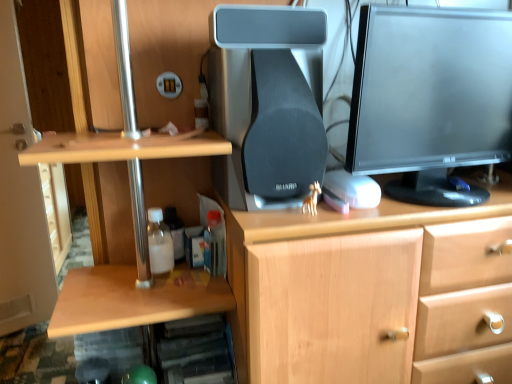
Question: Does matte black monitor at upper right have a lesser width compared to translucent plastic bottle at lower center, acting as the second bottle starting from the left?

Choices:
 (A) no
 (B) yes

Answer: (A)

Question: Could you tell me if matte black monitor at upper right is facing translucent plastic bottle at lower center, acting as the second bottle starting from the left?

Choices:
 (A) no
 (B) yes

Answer: (A)

Question: From the image's perspective, would you say matte black monitor at upper right is shown under translucent plastic bottle at lower center, acting as the second bottle starting from the left?

Choices:
 (A) yes
 (B) no

Answer: (B)

Question: Considering the relative sizes of matte black monitor at upper right and translucent plastic bottle at lower center, the first bottle viewed from the right, in the image provided, is matte black monitor at upper right taller than translucent plastic bottle at lower center, the first bottle viewed from the right,?

Choices:
 (A) no
 (B) yes

Answer: (B)

Question: Could translucent plastic bottle at lower center, the first bottle viewed from the right, be considered to be inside matte black monitor at upper right?

Choices:
 (A) yes
 (B) no

Answer: (B)

Question: From the image's perspective, is matte black monitor at upper right on top of translucent plastic bottle at lower center, the first bottle viewed from the right?

Choices:
 (A) no
 (B) yes

Answer: (B)

Question: Does translucent plastic bottle at lower center, the first bottle viewed from the right, have a larger size compared to black matte speaker at center?

Choices:
 (A) yes
 (B) no

Answer: (B)

Question: Does translucent plastic bottle at lower center, the first bottle viewed from the right, turn towards black matte speaker at center?

Choices:
 (A) no
 (B) yes

Answer: (A)

Question: Is black matte speaker at center surrounded by translucent plastic bottle at lower center, the first bottle viewed from the right?

Choices:
 (A) no
 (B) yes

Answer: (A)

Question: From the image's perspective, is translucent plastic bottle at lower center, the first bottle viewed from the right, over black matte speaker at center?

Choices:
 (A) yes
 (B) no

Answer: (B)

Question: Considering the relative sizes of translucent plastic bottle at lower center, acting as the second bottle starting from the left, and black matte speaker at center in the image provided, is translucent plastic bottle at lower center, acting as the second bottle starting from the left, taller than black matte speaker at center?

Choices:
 (A) yes
 (B) no

Answer: (B)

Question: Does translucent plastic bottle at lower center, acting as the second bottle starting from the left, lie behind black matte speaker at center?

Choices:
 (A) yes
 (B) no

Answer: (A)

Question: Is the depth of translucent plastic bottle at lower left, arranged as the 1th bottle when viewed from the left, greater than that of translucent plastic bottle at lower center, acting as the second bottle starting from the left?

Choices:
 (A) no
 (B) yes

Answer: (A)